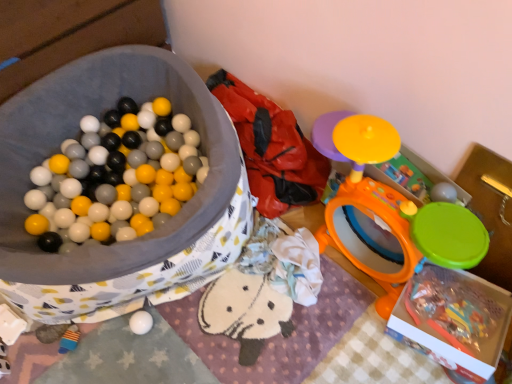
Locate an element on the screen. free spot to the right of white matte ball at lower center, marked as the third toy in a right-to-left arrangement is located at coordinates (189, 328).